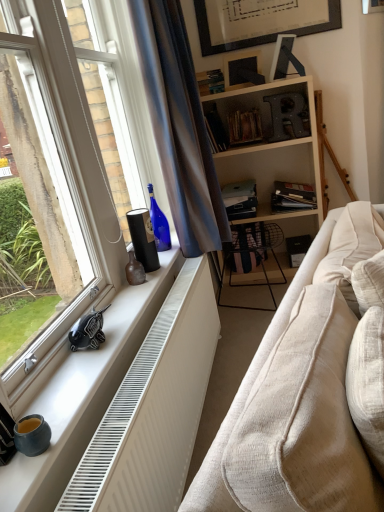
Question: From the image's perspective, does satin blue curtain at window appear lower than beige fabric couch at lower right?

Choices:
 (A) no
 (B) yes

Answer: (A)

Question: Considering the relative sizes of satin blue curtain at window and beige fabric couch at lower right in the image provided, is satin blue curtain at window taller than beige fabric couch at lower right?

Choices:
 (A) no
 (B) yes

Answer: (B)

Question: From a real-world perspective, is satin blue curtain at window beneath beige fabric couch at lower right?

Choices:
 (A) yes
 (B) no

Answer: (B)

Question: From a real-world perspective, is satin blue curtain at window on beige fabric couch at lower right?

Choices:
 (A) no
 (B) yes

Answer: (B)

Question: Is satin blue curtain at window directly adjacent to beige fabric couch at lower right?

Choices:
 (A) no
 (B) yes

Answer: (A)

Question: Can you confirm if satin blue curtain at window is thinner than beige fabric couch at lower right?

Choices:
 (A) yes
 (B) no

Answer: (A)

Question: Is brown matte vase at window sill wider than white textured radiator at lower left?

Choices:
 (A) yes
 (B) no

Answer: (B)

Question: Is brown matte vase at window sill closer to the viewer compared to white textured radiator at lower left?

Choices:
 (A) yes
 (B) no

Answer: (B)

Question: Can you confirm if brown matte vase at window sill is bigger than white textured radiator at lower left?

Choices:
 (A) no
 (B) yes

Answer: (A)

Question: Does brown matte vase at window sill appear on the right side of white textured radiator at lower left?

Choices:
 (A) yes
 (B) no

Answer: (B)

Question: Is white textured radiator at lower left at the back of brown matte vase at window sill?

Choices:
 (A) no
 (B) yes

Answer: (A)

Question: From a real-world perspective, is brown matte vase at window sill positioned under white textured radiator at lower left based on gravity?

Choices:
 (A) no
 (B) yes

Answer: (A)

Question: Is satin blue curtain at window located outside black matte book at center, the second book when ordered from bottom to top?

Choices:
 (A) yes
 (B) no

Answer: (A)